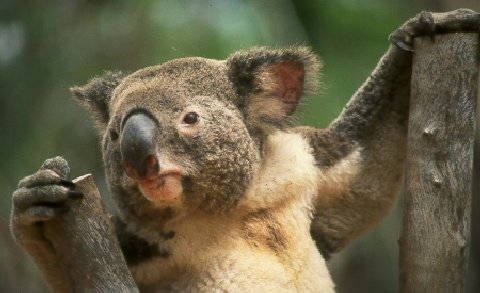
Image resolution: width=480 pixels, height=293 pixels. In order to click on grey wood in this screenshot , I will do `click(99, 253)`.